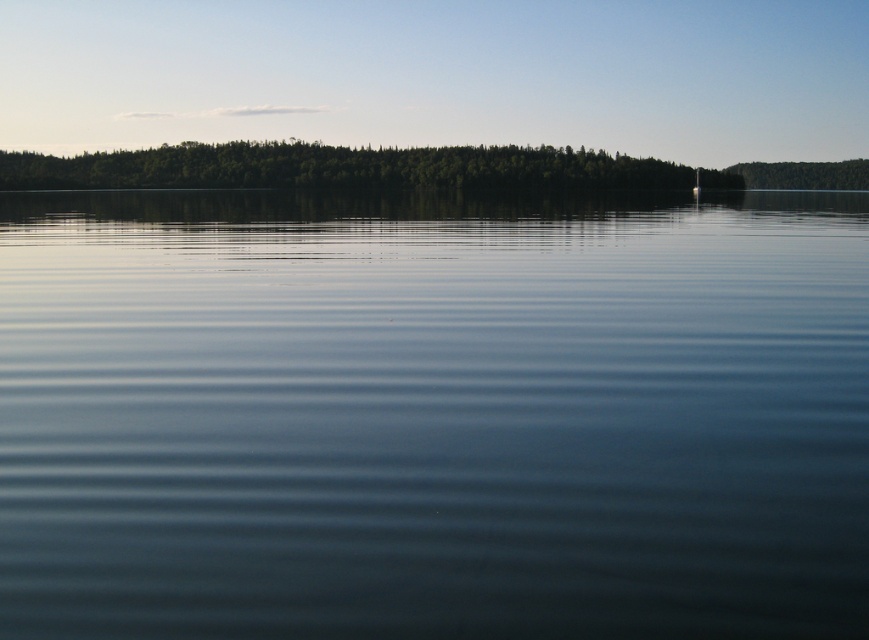
Question: Among these points, which one is nearest to the camera?

Choices:
 (A) (365, 234)
 (B) (140, 184)

Answer: (A)

Question: Does transparent water at center have a greater width compared to green leafy trees at upper center?

Choices:
 (A) no
 (B) yes

Answer: (A)

Question: Is transparent water at center to the right of green leafy trees at upper center from the viewer's perspective?

Choices:
 (A) no
 (B) yes

Answer: (B)

Question: Which of the following is the farthest from the observer?

Choices:
 (A) transparent water at center
 (B) green leafy trees at upper center

Answer: (B)

Question: Can you confirm if transparent water at center is positioned to the right of green leafy trees at upper center?

Choices:
 (A) yes
 (B) no

Answer: (A)

Question: Among these objects, which one is farthest from the camera?

Choices:
 (A) green leafy trees at upper center
 (B) transparent water at center

Answer: (A)